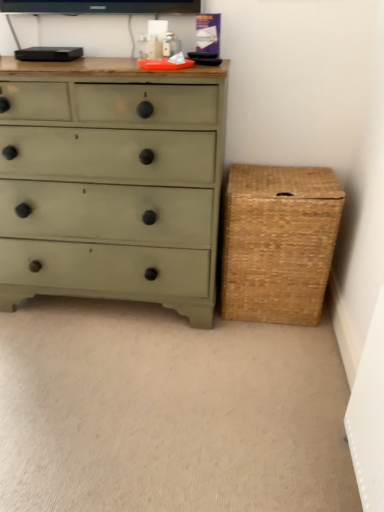
Measure the distance between point (245,196) and camera.

The depth of point (245,196) is 1.82 meters.

Identify the location of woven brown basket at right. This screenshot has width=384, height=512. (278, 242).

Image resolution: width=384 pixels, height=512 pixels. What do you see at coordinates (278, 242) in the screenshot?
I see `woven brown basket at right` at bounding box center [278, 242].

What are the coordinates of `matte green chest of drawers at left` in the screenshot? It's located at (111, 182).

The width and height of the screenshot is (384, 512). What do you see at coordinates (111, 182) in the screenshot?
I see `matte green chest of drawers at left` at bounding box center [111, 182].

At what (x,y) coordinates should I click in order to perform the action: click on woven brown basket at right. Please return your answer as a coordinate pair (x, y). Looking at the image, I should click on (278, 242).

Which is more to the left, matte green chest of drawers at left or woven brown basket at right?

Positioned to the left is matte green chest of drawers at left.

Is matte green chest of drawers at left behind woven brown basket at right?

No, it is not.

Which is closer to the camera, (196, 126) or (282, 288)?

Point (196, 126) appears to be closer to the viewer than point (282, 288).

From the image's perspective, between matte green chest of drawers at left and woven brown basket at right, who is located below?

woven brown basket at right appears lower in the image.

From a real-world perspective, is matte green chest of drawers at left located higher than woven brown basket at right?

Yes, from a real-world perspective, matte green chest of drawers at left is on top of woven brown basket at right.

Can you confirm if matte green chest of drawers at left is wider than woven brown basket at right?

Yes, matte green chest of drawers at left is wider than woven brown basket at right.

Considering the sizes of objects matte green chest of drawers at left and woven brown basket at right in the image provided, who is shorter, matte green chest of drawers at left or woven brown basket at right?

Standing shorter between the two is woven brown basket at right.

Does matte green chest of drawers at left have a larger size compared to woven brown basket at right?

Yes, matte green chest of drawers at left is bigger than woven brown basket at right.

Is matte green chest of drawers at left not inside woven brown basket at right?

Indeed, matte green chest of drawers at left is completely outside woven brown basket at right.

Is matte green chest of drawers at left positioned far away from woven brown basket at right?

They are positioned close to each other.

In the scene shown: Could you tell me if matte green chest of drawers at left is turned towards woven brown basket at right?

No, matte green chest of drawers at left is not turned towards woven brown basket at right.

What's the angular difference between matte green chest of drawers at left and woven brown basket at right's facing directions?

There is a 0.000306-degree angle between the facing directions of matte green chest of drawers at left and woven brown basket at right.

Identify the location of basket that is under the matte green chest of drawers at left (from a real-world perspective). The height and width of the screenshot is (512, 384). (278, 242).

Considering the relative positions of woven brown basket at right and matte green chest of drawers at left in the image provided, is woven brown basket at right to the right of matte green chest of drawers at left from the viewer's perspective?

Indeed, woven brown basket at right is positioned on the right side of matte green chest of drawers at left.

Who is more distant, woven brown basket at right or matte green chest of drawers at left?

woven brown basket at right.

Is point (233, 242) more distant than point (71, 247)?

No.

From the image's perspective, is woven brown basket at right located beneath matte green chest of drawers at left?

Yes, from the image's perspective, woven brown basket at right is below matte green chest of drawers at left.

From a real-world perspective, is woven brown basket at right on top of matte green chest of drawers at left?

No, from a real-world perspective, woven brown basket at right is not above matte green chest of drawers at left.

Considering the relative sizes of woven brown basket at right and matte green chest of drawers at left in the image provided, is woven brown basket at right thinner than matte green chest of drawers at left?

Yes.

Is woven brown basket at right taller than matte green chest of drawers at left?

In fact, woven brown basket at right may be shorter than matte green chest of drawers at left.

Who is bigger, woven brown basket at right or matte green chest of drawers at left?

matte green chest of drawers at left is bigger.

Would you say woven brown basket at right is inside or outside matte green chest of drawers at left?

woven brown basket at right lies outside matte green chest of drawers at left.

Would you say woven brown basket at right is a long distance from matte green chest of drawers at left?

They are positioned close to each other.

Could you tell me if woven brown basket at right is facing matte green chest of drawers at left?

No, woven brown basket at right is not oriented towards matte green chest of drawers at left.

What's the angular difference between woven brown basket at right and matte green chest of drawers at left's facing directions?

woven brown basket at right and matte green chest of drawers at left are facing 0.000306 degrees away from each other.

This screenshot has width=384, height=512. Identify the location of basket located behind the matte green chest of drawers at left. (278, 242).

Image resolution: width=384 pixels, height=512 pixels. What are the coordinates of `basket located below the matte green chest of drawers at left (from the image's perspective)` in the screenshot? It's located at (278, 242).

The height and width of the screenshot is (512, 384). In order to click on chest of drawers above the woven brown basket at right (from a real-world perspective) in this screenshot , I will do `click(111, 182)`.